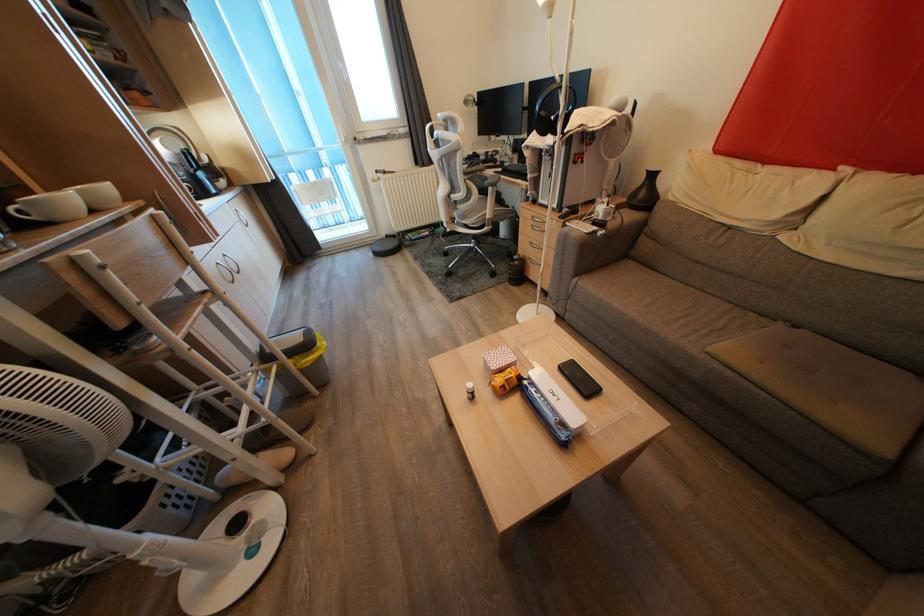
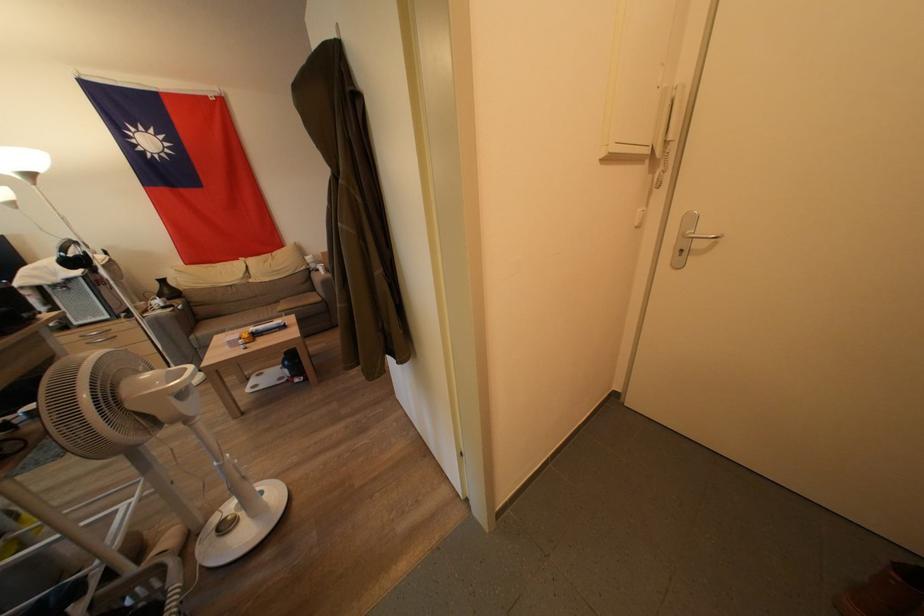
The point at (544, 205) is marked in the first image. Where is the corresponding point in the second image?

(81, 328)